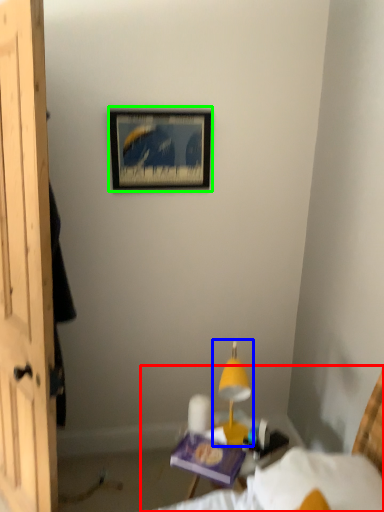
Question: Estimate the real-world distances between objects in this image. Which object is farther from bed (highlighted by a red box), table lamp (highlighted by a blue box) or picture frame (highlighted by a green box)?

Choices:
 (A) table lamp
 (B) picture frame

Answer: (B)